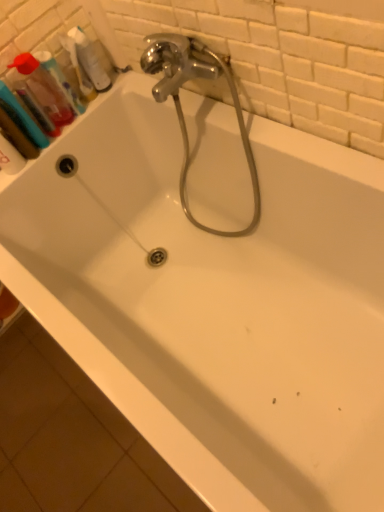
Question: From a real-world perspective, relative to translucent plastic bottle at upper left, is translucent plastic mouthwash at upper left, which ranks as the third mouthwash in left-to-right order, vertically above or below?

Choices:
 (A) below
 (B) above

Answer: (B)

Question: Is translucent plastic mouthwash at upper left, positioned as the 1th mouthwash in right-to-left order, bigger or smaller than translucent plastic bottle at upper left?

Choices:
 (A) big
 (B) small

Answer: (B)

Question: Which object is the closest to the translucent plastic mouthwash at upper left, which is counted as the 2th mouthwash, starting from the left?

Choices:
 (A) translucent plastic mouthwash at upper left, positioned as the 1th mouthwash in right-to-left order
 (B) translucent plastic mouthwash at upper left, marked as the third mouthwash in a right-to-left arrangement
 (C) translucent plastic bottle at upper left

Answer: (B)

Question: Estimate the real-world distances between objects in this image. Which object is closer to the translucent plastic mouthwash at upper left, which ranks as the 1th mouthwash in left-to-right order?

Choices:
 (A) translucent plastic mouthwash at upper left, which ranks as the third mouthwash in left-to-right order
 (B) translucent plastic bottle at upper left
 (C) translucent plastic mouthwash at upper left, which is counted as the 2th mouthwash, starting from the left

Answer: (C)